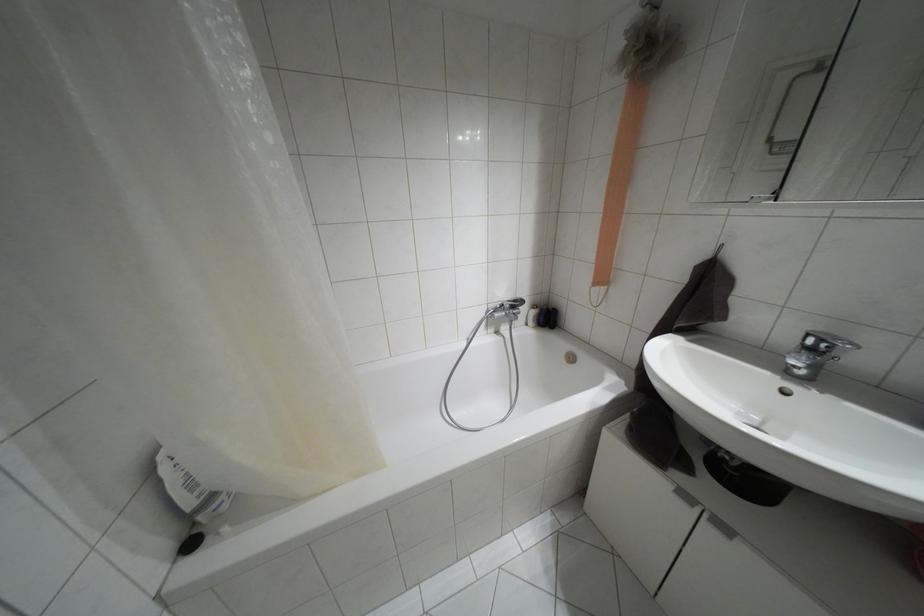
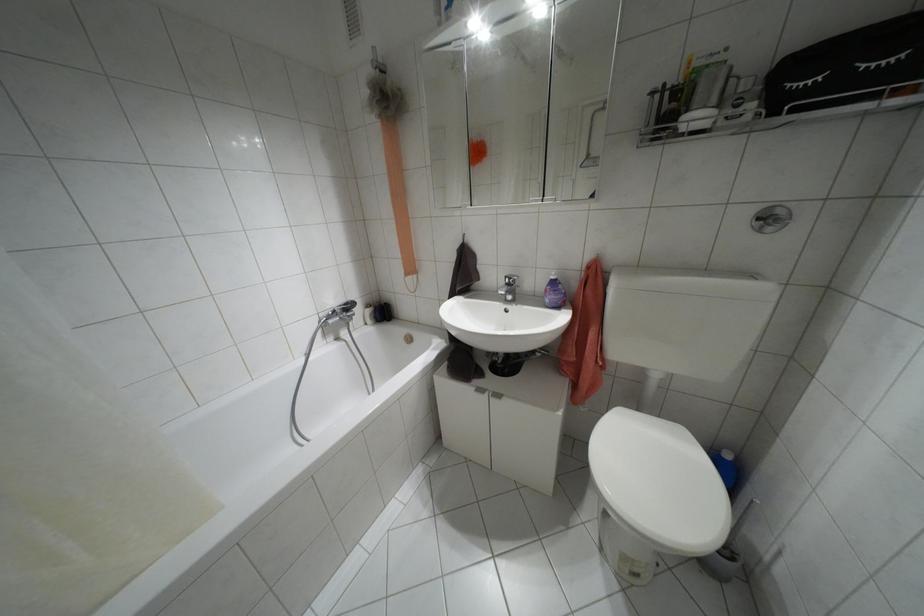
Question: The camera is either moving clockwise (left) or counter-clockwise (right) around the object. The first image is from the beginning of the video and the second image is from the end. Is the camera moving left or right when shooting the video?

Choices:
 (A) Left
 (B) Right

Answer: (A)